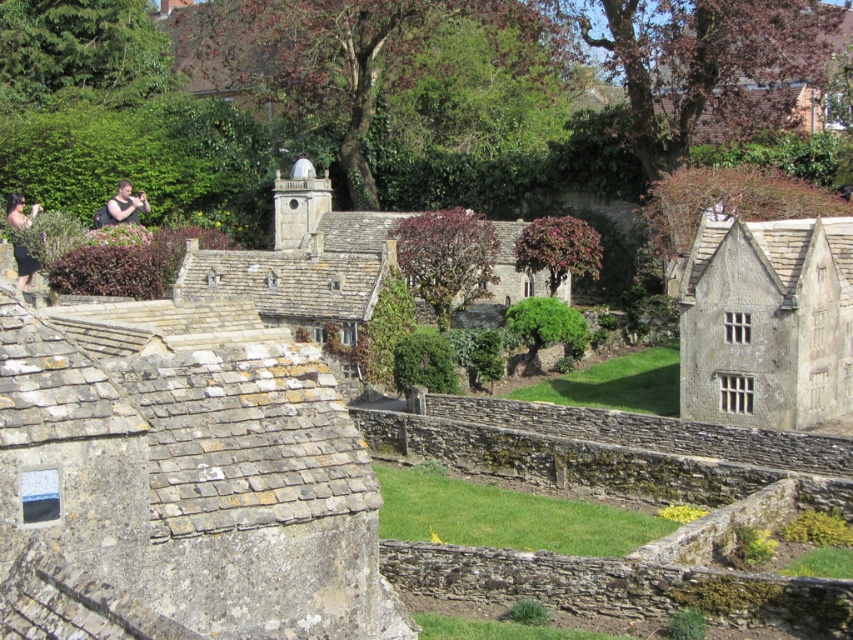
You are a fashion designer observing a miniature model village scene. You notice two items of clothing in the image. Which item is positioned further to the left between the matte black dress at left and the matte black shirt at upper left?

The matte black dress at left is positioned further to the left compared to the matte black shirt at upper left.

You are a fashion designer observing a miniature model village scene. You notice the matte black dress at left and the matte black shirt at upper left. Which clothing item appears closer to you in this arrangement?

The matte black dress at left is in front of the matte black shirt at upper left, so it appears closer to you.

You are standing in the miniature model village and want to place a small flag exactly halfway between point [20,196] and point [144,196]. Given that both points are along the same vertical line, will the flag be closer to the front or the back of the village scene?

The flag will be closer to the front of the village scene because the halfway point between point [20,196] and point [144,196] is closer to the point that is nearer to the viewer, which is point [20,196].